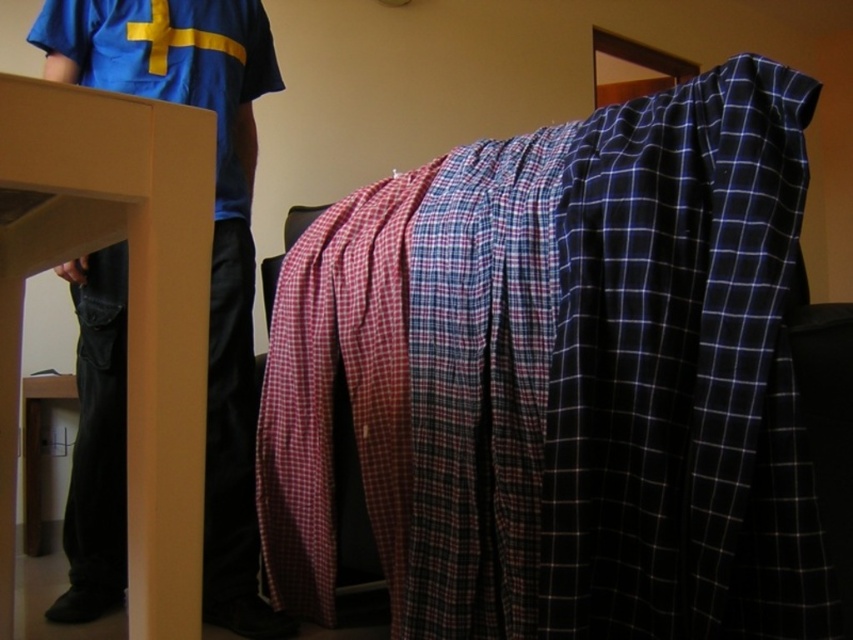
Between plaid fabric blanket at center and blue cotton shirt at upper left, which one has less height?

Standing shorter between the two is plaid fabric blanket at center.

Does point (770, 145) come behind point (224, 147)?

No, it is in front of (224, 147).

Image resolution: width=853 pixels, height=640 pixels. In order to click on plaid fabric blanket at center in this screenshot , I will do `click(561, 380)`.

Is blue cotton shirt at upper left below blue matte shirt at upper left?

Correct, blue cotton shirt at upper left is located below blue matte shirt at upper left.

The height and width of the screenshot is (640, 853). Find the location of `blue cotton shirt at upper left`. blue cotton shirt at upper left is located at coordinates [x=212, y=237].

Between plaid fabric blanket at center and blue matte shirt at upper left, which one has less height?

blue matte shirt at upper left

Which is in front, point (309, 481) or point (132, 61)?

Point (309, 481)

Where is `plaid fabric blanket at center`? The width and height of the screenshot is (853, 640). plaid fabric blanket at center is located at coordinates (561, 380).

Locate an element on the screen. The width and height of the screenshot is (853, 640). plaid fabric blanket at center is located at coordinates (561, 380).